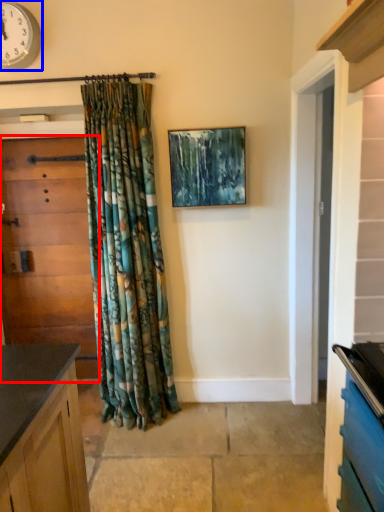
Question: Which object appears closest to the camera in this image, door (highlighted by a red box) or clock (highlighted by a blue box)?

Choices:
 (A) door
 (B) clock

Answer: (B)